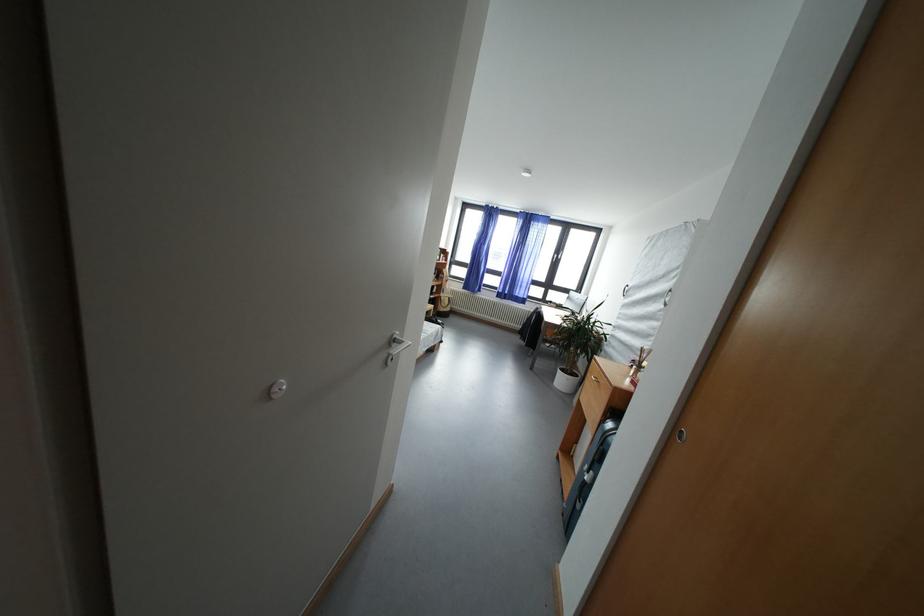
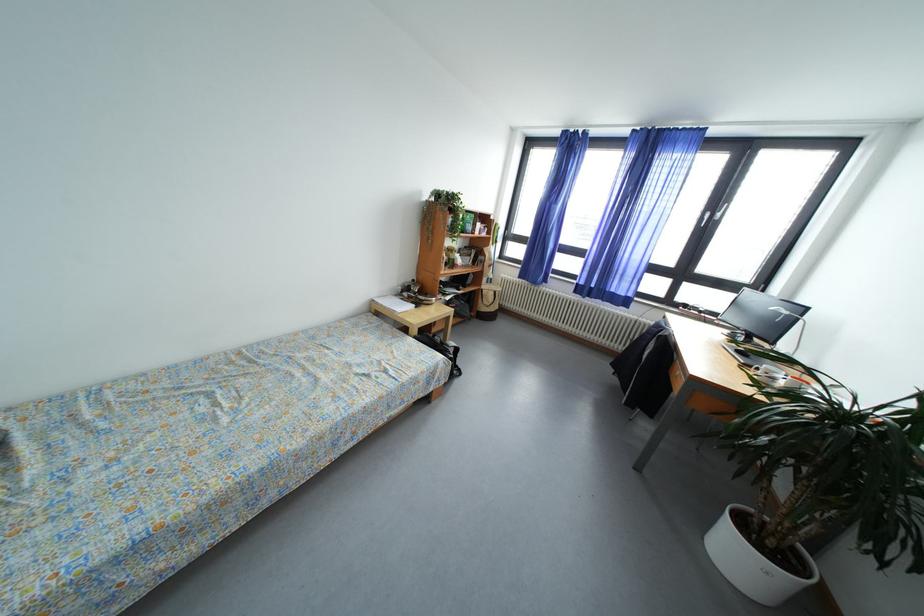
Where in the second image is the point corresponding to (568,386) from the first image?

(745, 561)